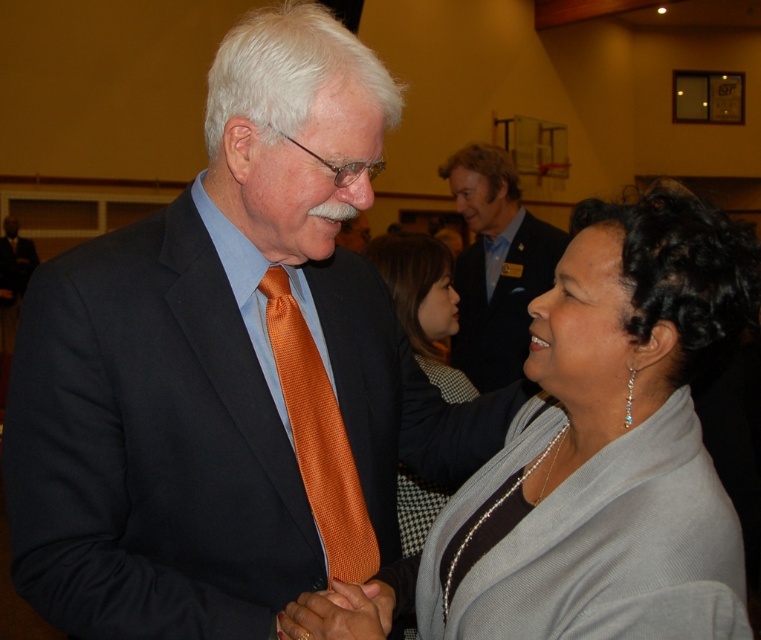
Based on the scene description, where is the orange satin tie at center located in terms of its 2D coordinates?

The orange satin tie at center is located at the 2D coordinates point (317, 436).

You are a photographer adjusting your camera settings to focus on both the blue textured suit at upper center and the orange satin tie at center. Which object should you focus on first to ensure proper depth of field?

The blue textured suit at upper center is closer to the viewer than the orange satin tie at center, so you should focus on the blue textured suit at upper center first to ensure proper depth of field.

From the picture: You are an event planner observing the scene. You need to ensure that the blue textured suit at upper center and the orange satin tie at center are visible in the photo for the event program. Based on their positions, which one is higher up in the image?

The blue textured suit at upper center is located above the orange satin tie at center, so it is higher up in the image.